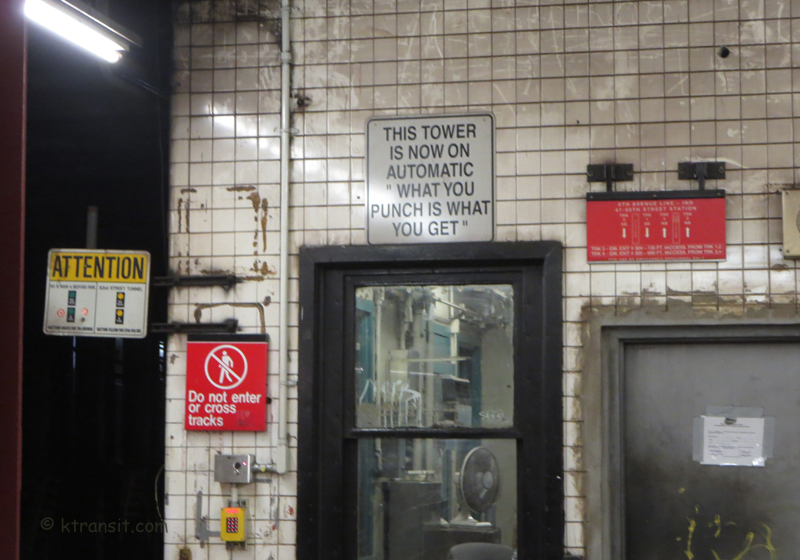
Where is `sign above door`? sign above door is located at coordinates (689, 235).